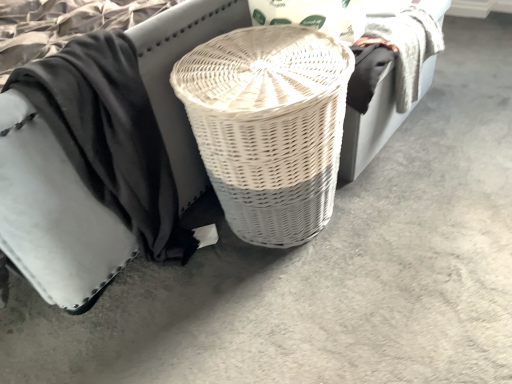
You are a GUI agent. You are given a task and a screenshot of the screen. Output one action in this format:
    pyautogui.click(x=<x>, y=<y>)
    Task: Click on the white wicker basket at center
    The width and height of the screenshot is (512, 384).
    Given the screenshot: What is the action you would take?
    pyautogui.click(x=56, y=221)

I want to click on white wicker basket at center, so click(269, 127).

You are a GUI agent. You are given a task and a screenshot of the screen. Output one action in this format:
    pyautogui.click(x=<x>, y=<y>)
    Task: Click on the white wicker basket at center
    
    Given the screenshot: What is the action you would take?
    pyautogui.click(x=56, y=221)

Is white wicker basket at center not within white wicker basket at center?

That's correct, white wicker basket at center is outside of white wicker basket at center.

Is white wicker basket at center not close to white wicker basket at center?

No, white wicker basket at center is not far away from white wicker basket at center.

Find the location of a particular element. Image resolution: width=512 pixels, height=384 pixels. basket lying below the white wicker basket at center (from the image's perspective) is located at coordinates (269, 127).

Considering the relative sizes of white wicker basket at center and white wicker basket at center in the image provided, is white wicker basket at center shorter than white wicker basket at center?

No.

Is white wicker basket at center smaller than black cotton cloth at center?

Actually, white wicker basket at center might be larger than black cotton cloth at center.

Measure the distance between white wicker basket at center and black cotton cloth at center.

white wicker basket at center is 10.28 centimeters from black cotton cloth at center.

Consider the image. From a real-world perspective, which is physically above, white wicker basket at center or black cotton cloth at center?

white wicker basket at center is physically above.

At what (x,y) coordinates should I click in order to perform the action: click on furniture above the black cotton cloth at center (from a real-world perspective). Please return your answer as a coordinate pair (x, y). Looking at the image, I should click on (56, 221).

How far apart are white wicker basket at center and black cotton cloth at center?

The distance of white wicker basket at center from black cotton cloth at center is 10.57 inches.

Would you say black cotton cloth at center is part of white wicker basket at center's contents?

No, white wicker basket at center does not contain black cotton cloth at center.

Based on the photo, between white wicker basket at center and black cotton cloth at center, which one has smaller width?

With smaller width is white wicker basket at center.

Between point (234, 60) and point (102, 196), which one is positioned in front?

Point (102, 196)

From the image's perspective, is white wicker basket at center positioned above or below white wicker basket at center?

Clearly, from the image's perspective, white wicker basket at center is below white wicker basket at center.

Would you say white wicker basket at center is part of white wicker basket at center's contents?

Definitely not — white wicker basket at center is not inside white wicker basket at center.

Is white wicker basket at center looking in the opposite direction of white wicker basket at center?

Yes, white wicker basket at center is at the back of white wicker basket at center.

At what (x,y) coordinates should I click in order to perform the action: click on furniture above the black cotton cloth at center (from the image's perspective). Please return your answer as a coordinate pair (x, y). Looking at the image, I should click on (56, 221).

From the image's perspective, would you say black cotton cloth at center is shown under white wicker basket at center?

Correct, black cotton cloth at center appears lower than white wicker basket at center in the image.

Is white wicker basket at center a part of black cotton cloth at center?

No, white wicker basket at center is located outside of black cotton cloth at center.

Which of these two, black cotton cloth at center or white wicker basket at center, stands taller?

Standing taller between the two is white wicker basket at center.

Consider the image. Is black cotton cloth at center facing towards white wicker basket at center?

No, black cotton cloth at center is not aimed at white wicker basket at center.

Where is `clothing above the white wicker basket at center (from a real-world perspective)`? clothing above the white wicker basket at center (from a real-world perspective) is located at coordinates (111, 136).

From the picture: Which of these two, black cotton cloth at center or white wicker basket at center, stands taller?

black cotton cloth at center is taller.

From a real-world perspective, is black cotton cloth at center physically below white wicker basket at center?

No.

The height and width of the screenshot is (384, 512). Identify the location of basket below the white wicker basket at center (from the image's perspective). (269, 127).

At what (x,y) coordinates should I click in order to perform the action: click on clothing behind the white wicker basket at center. Please return your answer as a coordinate pair (x, y). This screenshot has width=512, height=384. Looking at the image, I should click on (111, 136).

Based on their spatial positions, is black cotton cloth at center or white wicker basket at center closer to white wicker basket at center?

Among the two, black cotton cloth at center is located nearer to white wicker basket at center.

From the picture: From the image, which object appears to be farther from black cotton cloth at center, white wicker basket at center or white wicker basket at center?

white wicker basket at center.

Which object lies nearer to the anchor point white wicker basket at center, black cotton cloth at center or white wicker basket at center?

Among the two, black cotton cloth at center is located nearer to white wicker basket at center.

Based on their spatial positions, is white wicker basket at center or white wicker basket at center further from black cotton cloth at center?

white wicker basket at center lies further to black cotton cloth at center than the other object.

From the image, which object appears to be farther from white wicker basket at center, white wicker basket at center or black cotton cloth at center?

white wicker basket at center lies further to white wicker basket at center than the other object.

Looking at the image, which one is located closer to white wicker basket at center, white wicker basket at center or black cotton cloth at center?

black cotton cloth at center lies closer to white wicker basket at center than the other object.

Where is `clothing between white wicker basket at center and white wicker basket at center from left to right`? clothing between white wicker basket at center and white wicker basket at center from left to right is located at coordinates (111, 136).